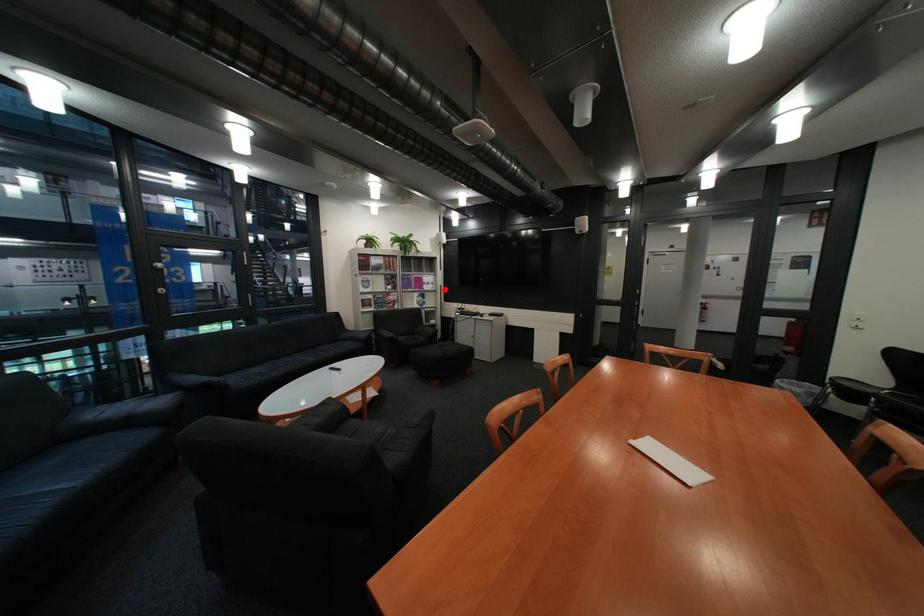
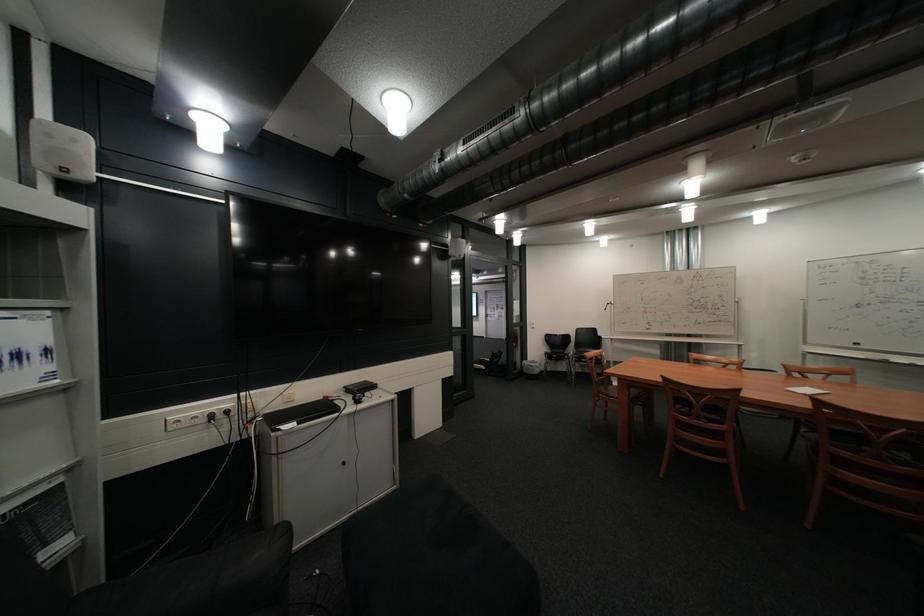
Question: I am providing you with two images of the same scene from different viewpoints. Image1 has a red point marked. In image2, the corresponding 3D location appears at what relative position? Reply with the corresponding letter.

Choices:
 (A) Closer
 (B) Farther

Answer: (B)